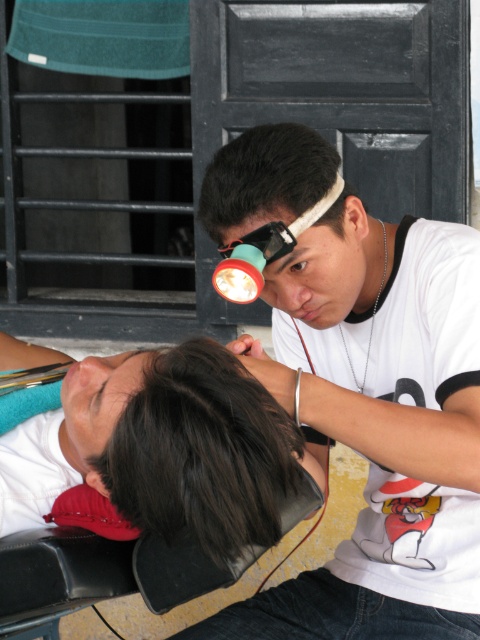
Between white matte headlamp at upper center and brown matte eye at center, which one appears on the right side from the viewer's perspective?

From the viewer's perspective, white matte headlamp at upper center appears more on the right side.

Is white matte headlamp at upper center closer to the viewer compared to brown matte eye at center?

Yes, white matte headlamp at upper center is in front of brown matte eye at center.

Does point (469, 257) lie behind point (308, 269)?

Yes, it is behind point (308, 269).

The image size is (480, 640). Identify the location of white matte headlamp at upper center. (380, 426).

Between dark brown hair at center and matte black ear at lower left, which one is positioned higher?

dark brown hair at center is higher up.

Measure the distance between dark brown hair at center and camera.

dark brown hair at center and camera are 4.15 feet apart from each other.

Does point (266, 547) come in front of point (100, 484)?

Yes, point (266, 547) is in front of point (100, 484).

Where is `dark brown hair at center`? dark brown hair at center is located at coordinates (203, 452).

Can you confirm if matte black ear at lower left is positioned above brown matte eye at center?

Actually, matte black ear at lower left is below brown matte eye at center.

Does matte black ear at lower left have a lesser width compared to brown matte eye at center?

No.

Which is in front, point (104, 492) or point (299, 269)?

Point (104, 492) is in front.

Locate an element on the screen. The height and width of the screenshot is (640, 480). matte black ear at lower left is located at coordinates (96, 481).